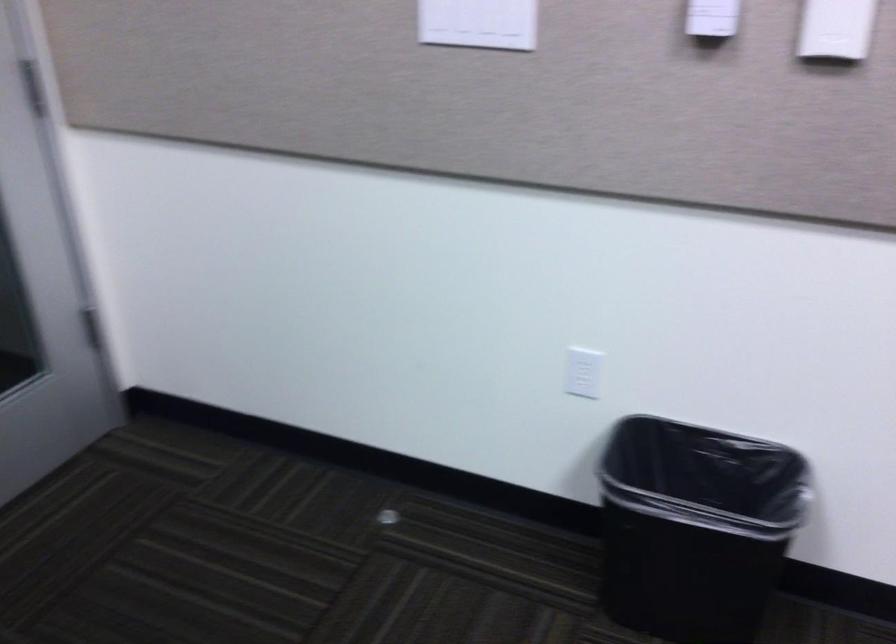
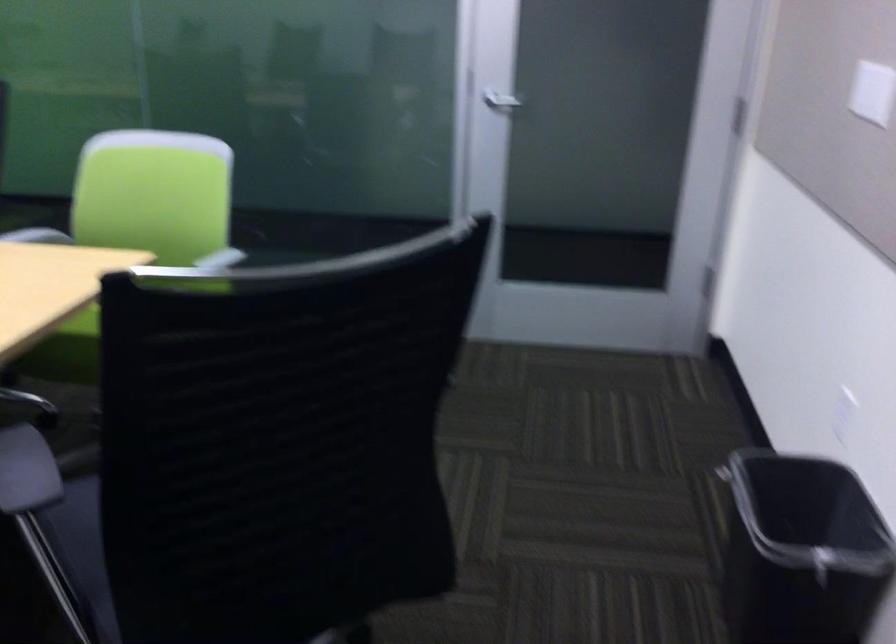
Where in the second image is the point corresponding to pixel 776 497 from the first image?

(800, 552)